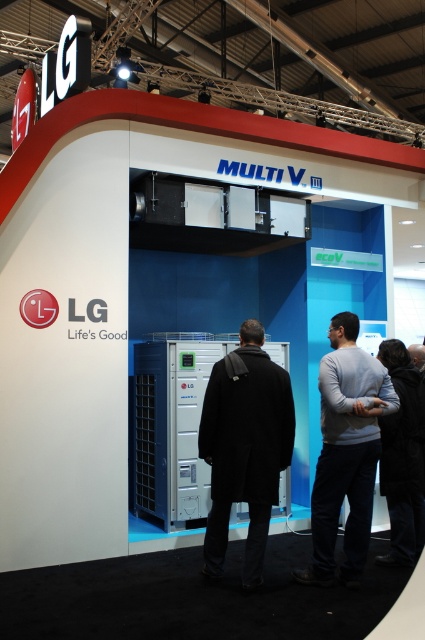
Question: Is black matte jacket at center above gray sweater at center?

Choices:
 (A) yes
 (B) no

Answer: (A)

Question: Does gray sweater at center appear under black fabric jacket at lower right?

Choices:
 (A) yes
 (B) no

Answer: (B)

Question: Can you confirm if black matte jacket at center is positioned to the right of black fabric jacket at lower right?

Choices:
 (A) no
 (B) yes

Answer: (A)

Question: Which of the following is the farthest from the observer?

Choices:
 (A) (343, 352)
 (B) (234, 435)

Answer: (A)

Question: Which point is closer to the camera taking this photo?

Choices:
 (A) (393, 515)
 (B) (348, 524)
 (C) (255, 576)

Answer: (C)

Question: Which object appears farthest from the camera in this image?

Choices:
 (A) black matte jacket at center
 (B) black fabric jacket at lower right
 (C) gray sweater at center

Answer: (B)